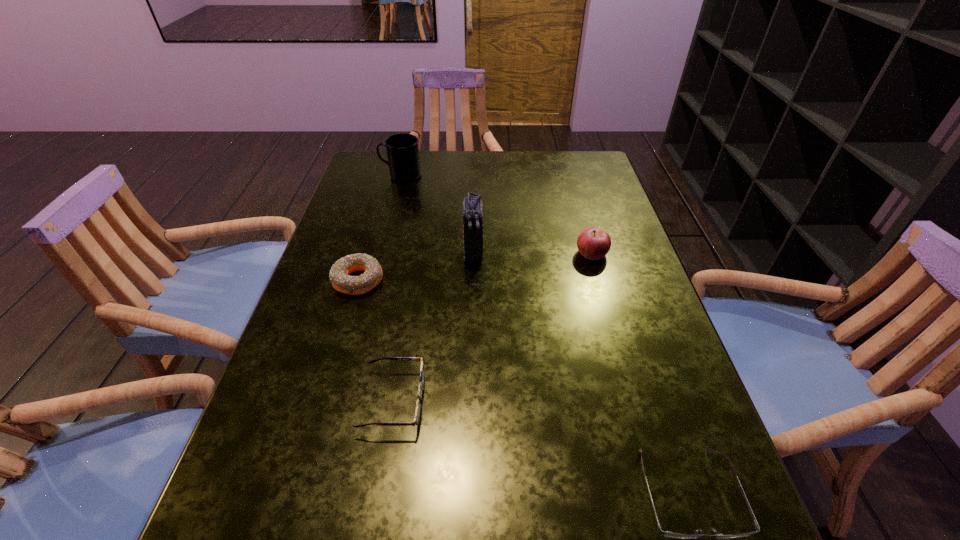
Locate an element on the screen. The width and height of the screenshot is (960, 540). vacant point located 0.290m on the front of the third tallest object is located at coordinates (623, 362).

Identify the location of free point located on the back of the doughnut. The image size is (960, 540). (383, 194).

Find the location of a particular element. The image size is (960, 540). vacant area located 0.310m on the frame of the fifth farthest object is located at coordinates (595, 400).

Image resolution: width=960 pixels, height=540 pixels. What are the coordinates of `object present at the far edge` in the screenshot? It's located at (402, 149).

Identify the location of mug that is positioned at the left edge. The width and height of the screenshot is (960, 540). (402, 149).

I want to click on doughnut that is at the left edge, so click(x=339, y=276).

The width and height of the screenshot is (960, 540). What are the coordinates of `object located in the right edge section of the desktop` in the screenshot? It's located at (593, 243).

The image size is (960, 540). Find the location of `object present at the far left corner`. object present at the far left corner is located at coordinates (402, 149).

The height and width of the screenshot is (540, 960). Identify the location of vacant space at the left edge of the desktop. (336, 342).

In the image, there is a desktop. At what (x,y) coordinates should I click in order to perform the action: click on vacant space at the right edge. Please return your answer as a coordinate pair (x, y). Image resolution: width=960 pixels, height=540 pixels. Looking at the image, I should click on (627, 330).